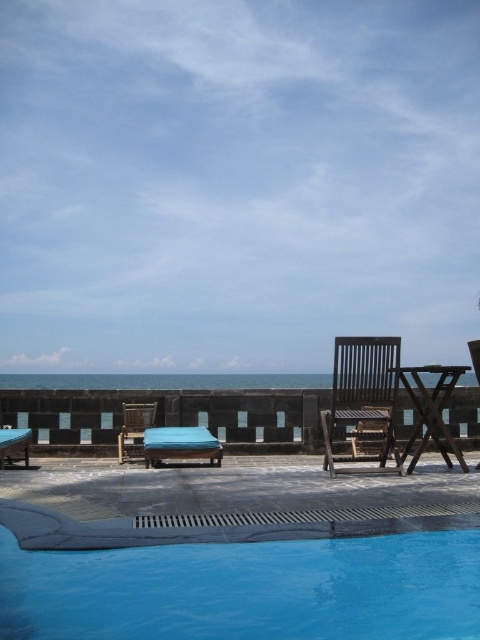
Question: Considering the relative positions of blue smooth water at lower center and dark brown wooden beach chair at center in the image provided, where is blue smooth water at lower center located with respect to dark brown wooden beach chair at center?

Choices:
 (A) right
 (B) left

Answer: (B)

Question: Can you confirm if dark brown wooden beach chair at center is positioned to the right of teal fabric chair at center?

Choices:
 (A) yes
 (B) no

Answer: (A)

Question: Among these points, which one is nearest to the camera?

Choices:
 (A) (204, 444)
 (B) (384, 388)
 (C) (128, 417)
 (D) (237, 616)

Answer: (D)

Question: Is dark brown wooden beach chair at center wider than wooden beach chair at center?

Choices:
 (A) yes
 (B) no

Answer: (A)

Question: Which point is closer to the camera taking this photo?

Choices:
 (A) (157, 449)
 (B) (156, 404)

Answer: (A)

Question: Which point appears closest to the camera in this image?

Choices:
 (A) (143, 442)
 (B) (145, 570)
 (C) (207, 442)

Answer: (B)